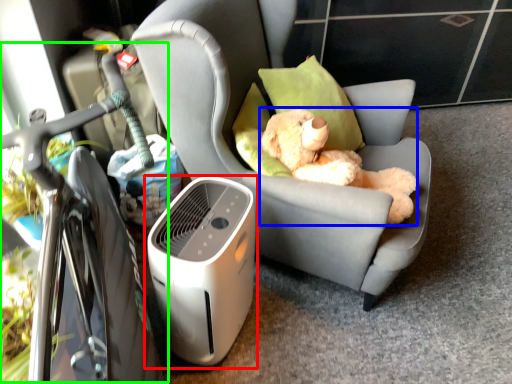
Question: Which object is the farthest from home appliance (highlighted by a red box)? Choose among these: toy (highlighted by a blue box) or bicycle (highlighted by a green box).

Choices:
 (A) toy
 (B) bicycle

Answer: (A)